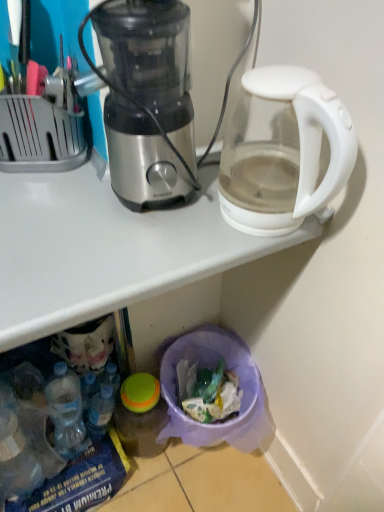
Where is `vacant area that is in front of stainless steel blender at center`? The width and height of the screenshot is (384, 512). vacant area that is in front of stainless steel blender at center is located at coordinates (124, 258).